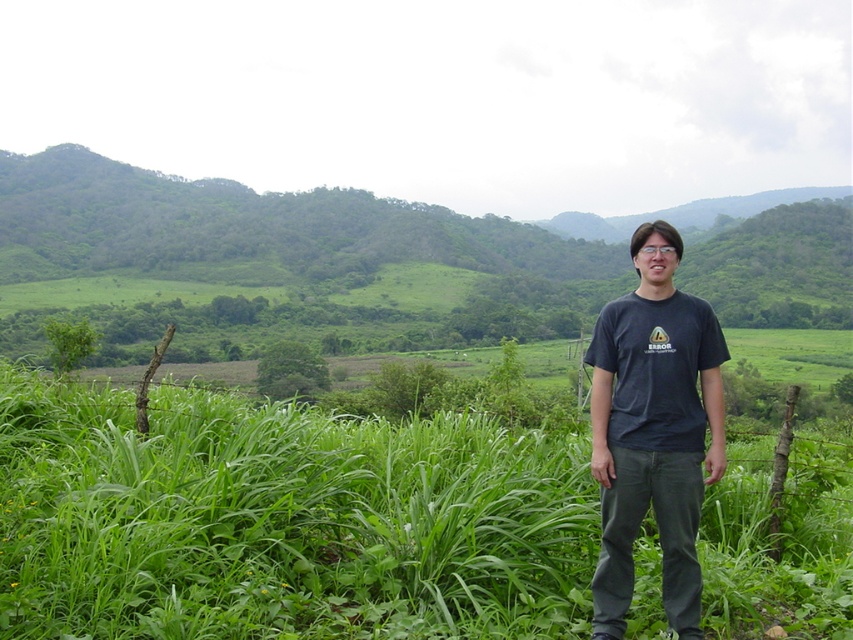
Is green grass at center further to the viewer compared to dark gray t-shirt at center?

Yes, green grass at center is further from the viewer.

Which is more to the left, green grass at center or dark gray t-shirt at center?

dark gray t-shirt at center

Is point (235, 483) positioned before point (599, 362)?

No, it is not.

Where is `green grass at center`? The image size is (853, 640). green grass at center is located at coordinates (282, 518).